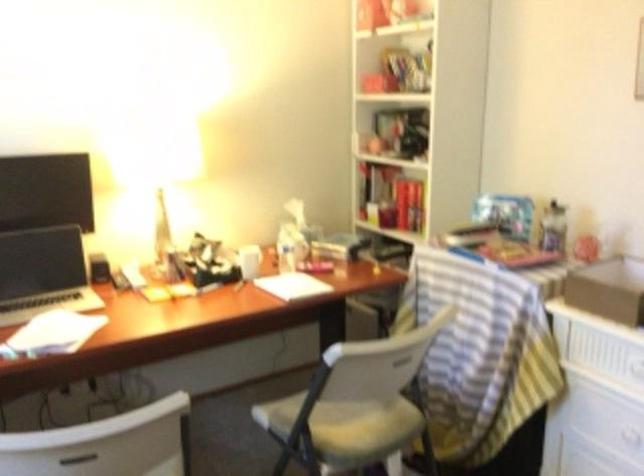
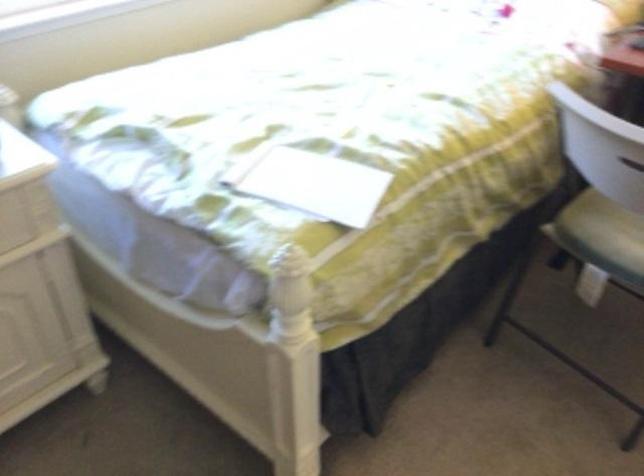
The images are taken continuously from a first-person perspective. In which direction is your viewpoint rotating?

The camera rotated toward left-down.